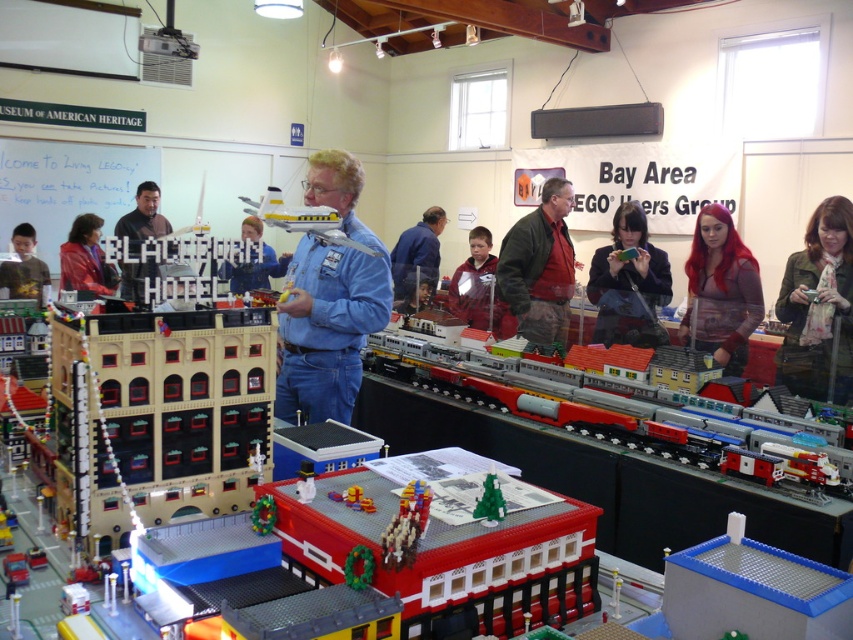
Between denim jacket at center and blue denim shirt at center, which one is positioned higher?

blue denim shirt at center is higher up.

Can you confirm if denim jacket at center is taller than blue denim shirt at center?

Indeed, denim jacket at center has a greater height compared to blue denim shirt at center.

The height and width of the screenshot is (640, 853). Identify the location of denim jacket at center. (329, 301).

Locate an element on the screen. denim jacket at center is located at coordinates (329, 301).

Is plaid shirt at center shorter than blue denim shirt at center?

Correct, plaid shirt at center is not as tall as blue denim shirt at center.

Looking at this image, is plaid shirt at center behind blue denim shirt at center?

No, it is in front of blue denim shirt at center.

Image resolution: width=853 pixels, height=640 pixels. What do you see at coordinates (476, 285) in the screenshot?
I see `plaid shirt at center` at bounding box center [476, 285].

Find the location of a particular element. Image resolution: width=853 pixels, height=640 pixels. plaid shirt at center is located at coordinates (476, 285).

Is point (73, 184) positioned in front of point (6, 273)?

No.

Is whiteboard at upper left to the left of yellow shirt at left from the viewer's perspective?

Indeed, whiteboard at upper left is positioned on the left side of yellow shirt at left.

Between point (67, 163) and point (22, 253), which one is positioned in front?

Positioned in front is point (22, 253).

Identify the location of whiteboard at upper left. This screenshot has height=640, width=853. (67, 186).